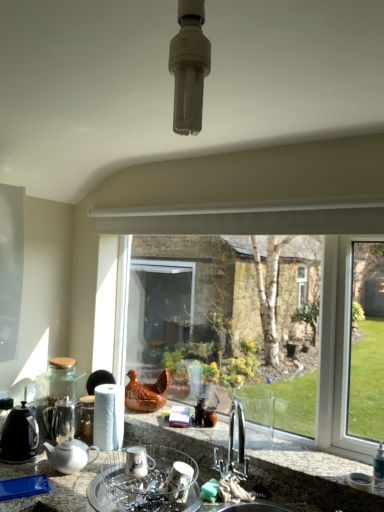
Image resolution: width=384 pixels, height=512 pixels. I want to click on free space on the front side of white ceramic mug at lower center, the first appliance when ordered from back to front, so click(132, 492).